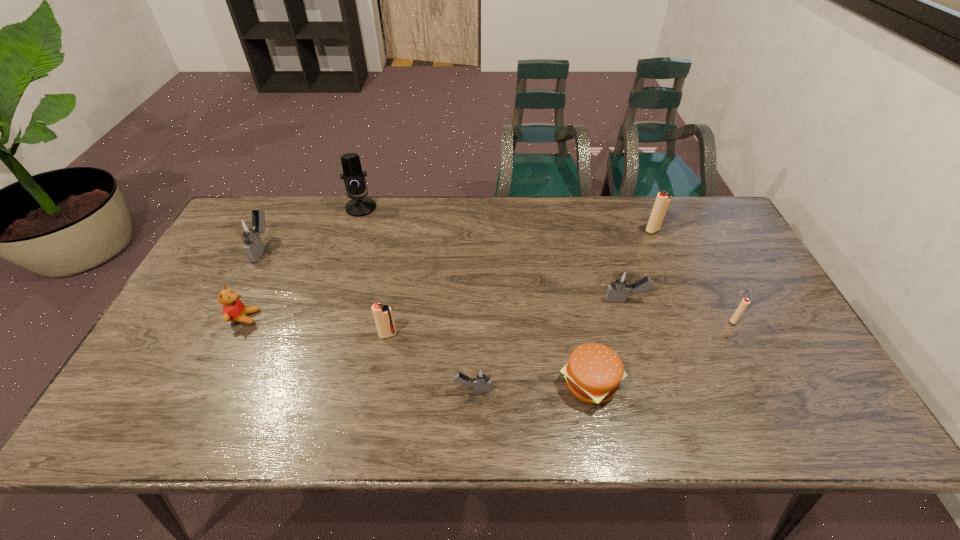
Where is `vacant point located between the hamburger and the biggest red igniter`? This screenshot has width=960, height=540. vacant point located between the hamburger and the biggest red igniter is located at coordinates (622, 307).

You are a GUI agent. You are given a task and a screenshot of the screen. Output one action in this format:
    pyautogui.click(x=<x>, y=<y>)
    Task: Click on the vacant point located between the fourth igniter from right to left and the leftmost gray igniter
    
    Given the screenshot: What is the action you would take?
    pyautogui.click(x=368, y=319)

Locate an element on the screen. free area in between the leftmost gray igniter and the fourth object from right to left is located at coordinates (426, 315).

In order to click on unoccupied area between the tallest object and the hamburger in this screenshot , I will do `click(476, 295)`.

You are a GUI agent. You are given a task and a screenshot of the screen. Output one action in this format:
    pyautogui.click(x=<x>, y=<y>)
    Task: Click on the vacant area between the tallest object and the smallest red igniter
    The image size is (960, 540).
    Given the screenshot: What is the action you would take?
    pyautogui.click(x=547, y=264)

Find the location of a particular element. This screenshot has width=960, height=540. free area in between the nearest red igniter and the leftmost gray igniter is located at coordinates (325, 291).

Identify which object is the fifth closest to the smallest red igniter. Please provide its 2D coordinates. Your answer should be formatted as a tuple, i.e. [(x, y)], where the tuple contains the x and y coordinates of a point satisfying the conditions above.

[(383, 317)]

Select which object is the third closest to the farthest gray igniter. Please provide its 2D coordinates. Your answer should be formatted as a tuple, i.e. [(x, y)], where the tuple contains the x and y coordinates of a point satisfying the conditions above.

[(383, 317)]

Find the location of `igniter identified as the second closest to the biggest gray igniter`. igniter identified as the second closest to the biggest gray igniter is located at coordinates (481, 378).

Locate an element on the screen. This screenshot has height=540, width=960. igniter that is the third closest to the fifth object from left to right is located at coordinates (743, 305).